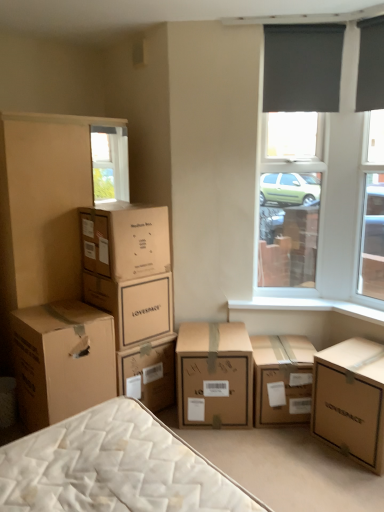
Image resolution: width=384 pixels, height=512 pixels. What do you see at coordinates (133, 305) in the screenshot?
I see `brown cardboard box at center-left, the 3th box viewed from the left` at bounding box center [133, 305].

This screenshot has width=384, height=512. Find the location of `brown cardboard box at center-left, the 3th box viewed from the left`. brown cardboard box at center-left, the 3th box viewed from the left is located at coordinates (133, 305).

This screenshot has height=512, width=384. I want to click on dark gray fabric at upper right, so click(302, 67).

Where is `brown cardboard box at upper left, placed as the 5th box when sorted from right to left`? The image size is (384, 512). brown cardboard box at upper left, placed as the 5th box when sorted from right to left is located at coordinates (125, 240).

Looking at this image, in order to face brown cardboard box at center, positioned as the fourth box in left-to-right order, should I rotate leftwards or rightwards?

Rotate your view right by about 2.700°.

Describe the element at coordinates (214, 374) in the screenshot. The image size is (384, 512). I see `brown cardboard box at center, which is the 3th box from right to left` at that location.

Locate an element on the screen. The width and height of the screenshot is (384, 512). brown cardboard box at lower left, the 6th box when ordered from right to left is located at coordinates (62, 360).

I want to click on brown cardboard box at center-left, the 3th box viewed from the left, so click(x=133, y=305).

Is brown cardboard box at center, positioned as the fourth box in left-to-right order, oriented away from brown cardboard box at lower left, the 6th box when ordered from right to left?

No, brown cardboard box at center, positioned as the fourth box in left-to-right order, is not facing the opposite direction of brown cardboard box at lower left, the 6th box when ordered from right to left.

Between brown cardboard box at center, which is the 3th box from right to left, and brown cardboard box at lower left, the 6th box when ordered from right to left, which one is positioned in front?

brown cardboard box at lower left, the 6th box when ordered from right to left.

How different are the orientations of brown cardboard box at center, which is the 3th box from right to left, and brown cardboard box at lower left, the 6th box when ordered from right to left, in degrees?

40.5 degrees.

Which is behind, point (275, 233) or point (373, 37)?

Point (275, 233)

Which is more to the right, black matte window screen at upper right or dark gray fabric at upper right?

black matte window screen at upper right is more to the right.

Could dark gray fabric at upper right be considered to be inside black matte window screen at upper right?

No.

Would you consider black matte window screen at upper right to be distant from dark gray fabric at upper right?

Yes.

Is brown cardboard box at upper left, placed as the 5th box when sorted from right to left, far away from black matte window screen at upper right?

That's right, there is a large distance between brown cardboard box at upper left, placed as the 5th box when sorted from right to left, and black matte window screen at upper right.

From the image's perspective, is brown cardboard box at upper left, placed as the 5th box when sorted from right to left, positioned above or below black matte window screen at upper right?

Clearly, from the image's perspective, brown cardboard box at upper left, placed as the 5th box when sorted from right to left, is below black matte window screen at upper right.

In the scene shown: Is brown cardboard box at upper left, positioned as the second box in left-to-right order, oriented towards black matte window screen at upper right?

No, brown cardboard box at upper left, positioned as the second box in left-to-right order, does not turn towards black matte window screen at upper right.

In the scene shown: Which object is positioned more to the right, brown cardboard box at upper left, positioned as the second box in left-to-right order, or black matte window screen at upper right?

black matte window screen at upper right.

Identify the location of the 3rd box counting from the right side of the brown cardboard box at upper left, placed as the 5th box when sorted from right to left. The height and width of the screenshot is (512, 384). (282, 379).

Considering the relative sizes of brown cardboard box at center, marked as the fifth box in a left-to-right arrangement, and brown cardboard box at upper left, placed as the 5th box when sorted from right to left, in the image provided, is brown cardboard box at center, marked as the fifth box in a left-to-right arrangement, bigger than brown cardboard box at upper left, placed as the 5th box when sorted from right to left,?

No.

Between brown cardboard box at center, marked as the fifth box in a left-to-right arrangement, and brown cardboard box at upper left, placed as the 5th box when sorted from right to left, which one is positioned behind?

brown cardboard box at center, marked as the fifth box in a left-to-right arrangement, is further away from the camera.

Consider the image. From the image's perspective, relative to brown cardboard box at upper left, positioned as the second box in left-to-right order, is brown cardboard box at center, acting as the second box starting from the right, above or below?

brown cardboard box at center, acting as the second box starting from the right, is below brown cardboard box at upper left, positioned as the second box in left-to-right order.

Is dark gray fabric at upper right thinner than brown cardboard box at center, positioned as the fourth box in left-to-right order?

Yes.

Is point (377, 106) closer to camera compared to point (225, 417)?

Yes, it is in front of point (225, 417).

Is dark gray fabric at upper right directly adjacent to brown cardboard box at center, which is the 3th box from right to left?

No, dark gray fabric at upper right is not in contact with brown cardboard box at center, which is the 3th box from right to left.

Does dark gray fabric at upper right have a lesser height compared to brown cardboard box at center, positioned as the fourth box in left-to-right order?

Correct, dark gray fabric at upper right is not as tall as brown cardboard box at center, positioned as the fourth box in left-to-right order.

From the image's perspective, which is above, brown cardboard box at center-left, the 3th box viewed from the left, or brown cardboard box at upper left, placed as the 5th box when sorted from right to left?

brown cardboard box at upper left, placed as the 5th box when sorted from right to left, from the image's perspective.

Based on their positions, is brown cardboard box at center-left, the 3th box viewed from the left, located to the left or right of brown cardboard box at upper left, positioned as the second box in left-to-right order?

Based on their positions, brown cardboard box at center-left, the 3th box viewed from the left, is located to the right of brown cardboard box at upper left, positioned as the second box in left-to-right order.

Is brown cardboard box at center-left, the 3th box viewed from the left, inside the boundaries of brown cardboard box at upper left, placed as the 5th box when sorted from right to left, or outside?

brown cardboard box at center-left, the 3th box viewed from the left, cannot be found inside brown cardboard box at upper left, placed as the 5th box when sorted from right to left.

Is black matte window screen at upper right facing towards brown cardboard box at upper left, positioned as the second box in left-to-right order?

No, black matte window screen at upper right is not aimed at brown cardboard box at upper left, positioned as the second box in left-to-right order.

Between point (305, 222) and point (158, 230), which one is positioned behind?

The point (305, 222) is farther from the camera.

Which of these two, black matte window screen at upper right or brown cardboard box at upper left, placed as the 5th box when sorted from right to left, is smaller?

black matte window screen at upper right.

Is black matte window screen at upper right further to camera compared to brown cardboard box at upper left, placed as the 5th box when sorted from right to left?

Yes, it is.

Locate an element on the screen. Image resolution: width=384 pixels, height=512 pixels. the 1st box located above the brown cardboard box at center, positioned as the fourth box in left-to-right order (from a real-world perspective) is located at coordinates (62, 360).

Where is `window screen behind the dark gray fabric at upper right`? window screen behind the dark gray fabric at upper right is located at coordinates (289, 197).

Based on the photo, considering their positions, is black matte window screen at upper right positioned further to lovespace cardboard box at lower right, acting as the first box starting from the right, than brown cardboard box at center, marked as the fifth box in a left-to-right arrangement?

Based on the image, black matte window screen at upper right appears to be further to lovespace cardboard box at lower right, acting as the first box starting from the right.

Consider the image. Based on their spatial positions, is brown cardboard box at center, acting as the second box starting from the right, or brown cardboard box at upper left, positioned as the second box in left-to-right order, closer to dark gray fabric at upper right?

Among the two, brown cardboard box at upper left, positioned as the second box in left-to-right order, is located nearer to dark gray fabric at upper right.

Estimate the real-world distances between objects in this image. Which object is closer to lovespace cardboard box at lower right, which is counted as the sixth box, starting from the left, brown cardboard box at center, positioned as the fourth box in left-to-right order, or black matte window screen at upper right?

brown cardboard box at center, positioned as the fourth box in left-to-right order, is positioned closer to the anchor lovespace cardboard box at lower right, which is counted as the sixth box, starting from the left.

Considering their positions, is brown cardboard box at center, acting as the second box starting from the right, positioned further to brown cardboard box at lower left, the 6th box when ordered from right to left, than lovespace cardboard box at lower right, acting as the first box starting from the right?

lovespace cardboard box at lower right, acting as the first box starting from the right, lies further to brown cardboard box at lower left, the 6th box when ordered from right to left, than the other object.

Considering their positions, is brown cardboard box at center, acting as the second box starting from the right, positioned further to black matte window screen at upper right than dark gray fabric at upper right?

brown cardboard box at center, acting as the second box starting from the right.

Looking at the image, which one is located closer to brown cardboard box at center, acting as the second box starting from the right, brown cardboard box at upper left, placed as the 5th box when sorted from right to left, or black matte window screen at upper right?

Based on the image, brown cardboard box at upper left, placed as the 5th box when sorted from right to left, appears to be nearer to brown cardboard box at center, acting as the second box starting from the right.

Looking at the image, which one is located further to black matte window screen at upper right, brown cardboard box at upper left, positioned as the second box in left-to-right order, or dark gray fabric at upper right?

brown cardboard box at upper left, positioned as the second box in left-to-right order.

Which object lies nearer to the anchor point brown cardboard box at center, positioned as the fourth box in left-to-right order, brown cardboard box at upper left, placed as the 5th box when sorted from right to left, or black matte window screen at upper right?

brown cardboard box at upper left, placed as the 5th box when sorted from right to left.

Image resolution: width=384 pixels, height=512 pixels. In order to click on window screen between dark gray fabric at upper right and brown cardboard box at center, which is the 3th box from right to left, vertically in this screenshot , I will do `click(289, 197)`.

Where is `box located between brown cardboard box at center-left, the 4th box when ordered from right to left, and brown cardboard box at center, marked as the fifth box in a left-to-right arrangement, in the left-right direction`? This screenshot has height=512, width=384. box located between brown cardboard box at center-left, the 4th box when ordered from right to left, and brown cardboard box at center, marked as the fifth box in a left-to-right arrangement, in the left-right direction is located at coordinates pos(214,374).

Identify the location of window screen between brown cardboard box at upper left, placed as the 5th box when sorted from right to left, and lovespace cardboard box at lower right, acting as the first box starting from the right, from left to right. (289, 197).

I want to click on window screen between dark gray fabric at upper right and brown cardboard box at center-left, the 4th box when ordered from right to left, in the up-down direction, so click(289, 197).